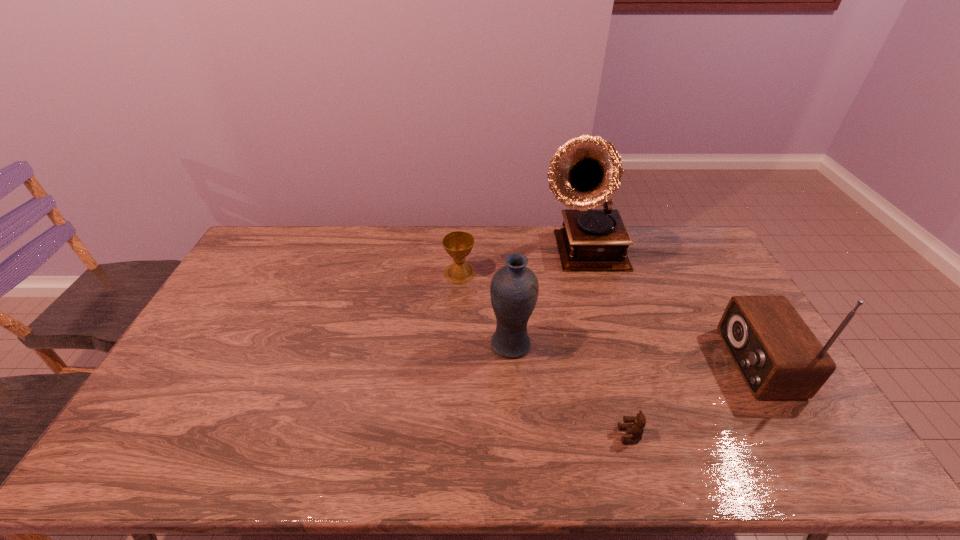
Locate an element on the screen. The width and height of the screenshot is (960, 540). unoccupied position between the tallest object and the vase is located at coordinates pyautogui.click(x=547, y=300).

Where is `free point between the record player and the shortest object`? The image size is (960, 540). free point between the record player and the shortest object is located at coordinates (608, 345).

The height and width of the screenshot is (540, 960). I want to click on free space between the second shortest object and the radio receiver, so click(609, 318).

I want to click on vacant space that's between the fourth object from right to left and the leftmost object, so click(x=486, y=309).

At what (x,y) coordinates should I click in order to perform the action: click on vacant space that is in between the record player and the nearest object. Please return your answer as a coordinate pair (x, y). Looking at the image, I should click on (608, 345).

At what (x,y) coordinates should I click in order to perform the action: click on the second closest object relative to the rightmost object. Please return your answer as a coordinate pair (x, y). Looking at the image, I should click on (636, 429).

Locate which object is the third closest to the vase. Please provide its 2D coordinates. Your answer should be formatted as a tuple, i.e. [(x, y)], where the tuple contains the x and y coordinates of a point satisfying the conditions above.

[(636, 429)]